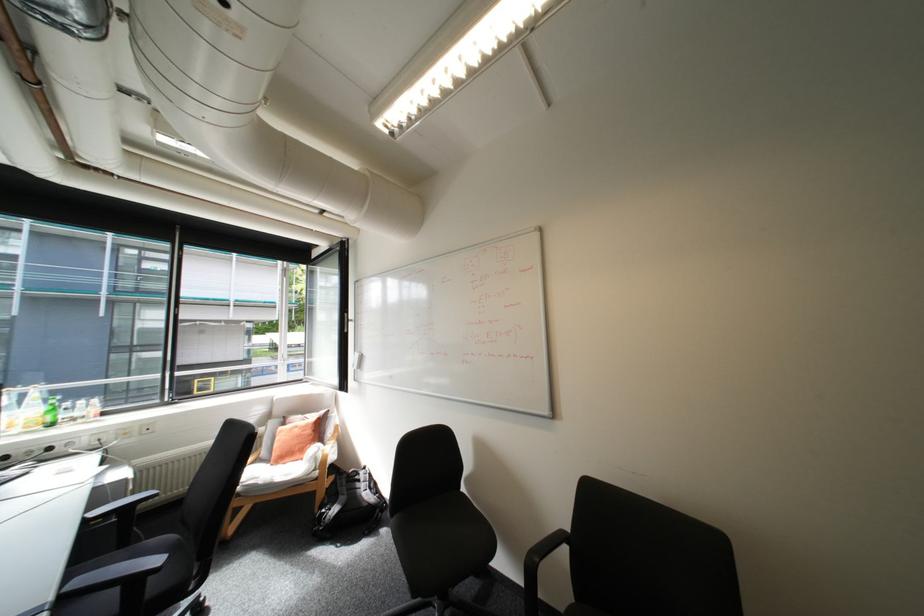
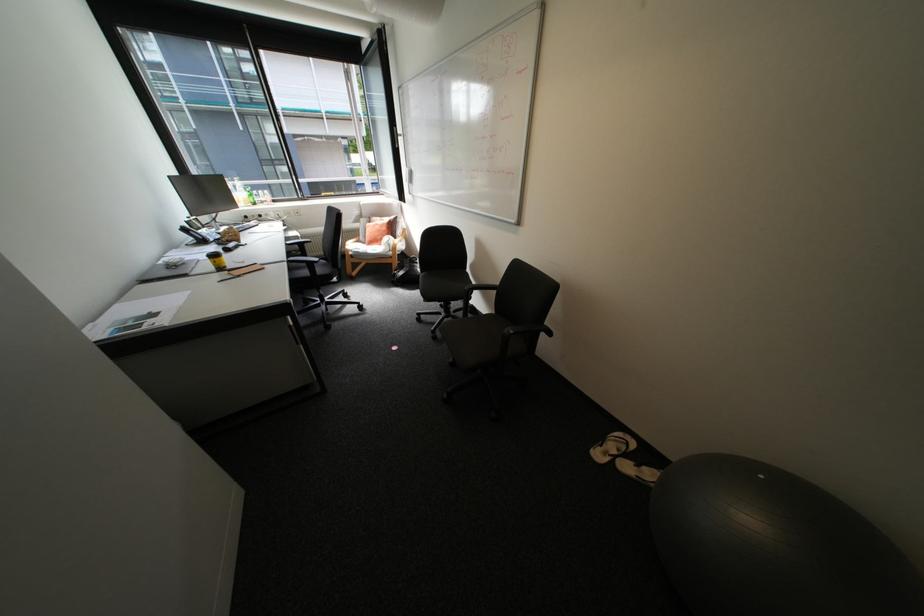
Where in the second image is the point corresponding to point (94, 519) from the first image?

(296, 244)